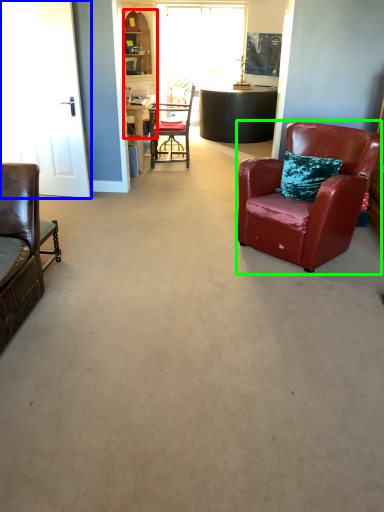
Question: Which is nearer to the cabinetry (highlighted by a red box)? glass door (highlighted by a blue box) or chair (highlighted by a green box).

Choices:
 (A) glass door
 (B) chair

Answer: (A)